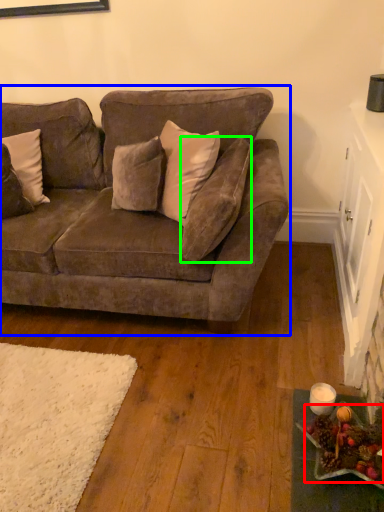
Question: Estimate the real-world distances between objects in this image. Which object is farther from food (highlighted by a red box), studio couch (highlighted by a blue box) or pillow (highlighted by a green box)?

Choices:
 (A) studio couch
 (B) pillow

Answer: (A)